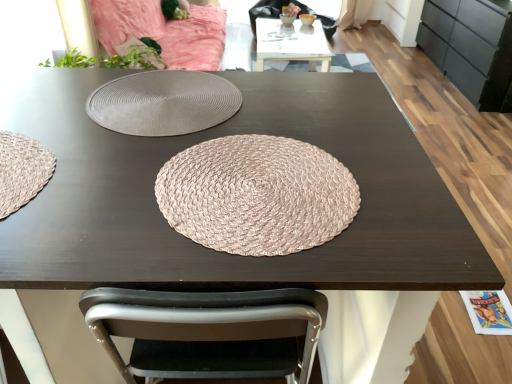
I want to click on vacant space underneath matte gray placemat at center (from a real-world perspective), so click(x=164, y=102).